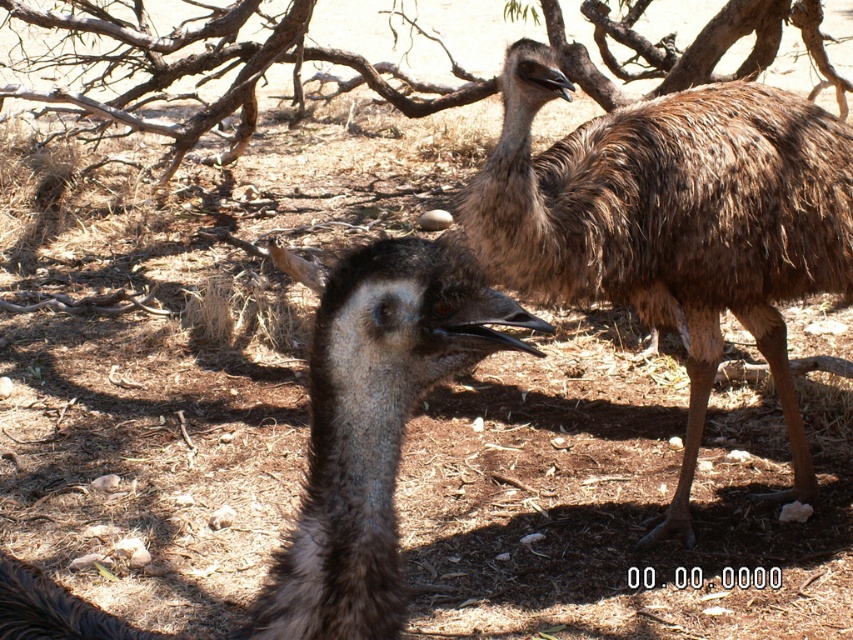
Does brown feathered ostrich at center appear on the left side of brown textured branches at upper center?

In fact, brown feathered ostrich at center is to the right of brown textured branches at upper center.

Between brown feathered ostrich at center and brown textured branches at upper center, which one appears on the right side from the viewer's perspective?

brown feathered ostrich at center is more to the right.

Does point (328, 536) lie in front of point (663, 77)?

That is True.

Find the location of a particular element. This screenshot has height=640, width=853. brown feathered ostrich at center is located at coordinates (373, 428).

Is point (602, 221) behind point (360, 376)?

Yes, it is behind point (360, 376).

Is brown fuzzy ostrich at upper right below brown feathered ostrich at center?

Incorrect, brown fuzzy ostrich at upper right is not positioned below brown feathered ostrich at center.

This screenshot has width=853, height=640. Describe the element at coordinates (672, 224) in the screenshot. I see `brown fuzzy ostrich at upper right` at that location.

You are a GUI agent. You are given a task and a screenshot of the screen. Output one action in this format:
    pyautogui.click(x=<x>, y=<y>)
    Task: Click on the brown fuzzy ostrich at upper right
    The height and width of the screenshot is (640, 853).
    Given the screenshot: What is the action you would take?
    pyautogui.click(x=672, y=224)

Between point (531, 248) and point (137, 106), which one is positioned behind?

The point (137, 106) is more distant.

Is brown fuzzy ostrich at upper right thinner than brown textured branches at upper center?

No, brown fuzzy ostrich at upper right is not thinner than brown textured branches at upper center.

Which is behind, point (807, 196) or point (840, 115)?

The point (840, 115) is more distant.

The width and height of the screenshot is (853, 640). What are the coordinates of `brown fuzzy ostrich at upper right` in the screenshot? It's located at (672, 224).